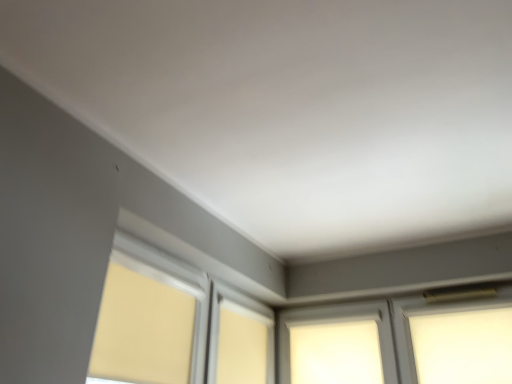
Question: Should I look upward or downward to see white frosted glass at upper right, placed as the second window when sorted from left to right?

Choices:
 (A) down
 (B) up

Answer: (A)

Question: Considering the relative sizes of white frosted glass at center, acting as the first window starting from the left, and white frosted glass at upper right, which appears as the 1th window when viewed from the right, in the image provided, is white frosted glass at center, acting as the first window starting from the left, smaller than white frosted glass at upper right, which appears as the 1th window when viewed from the right,?

Choices:
 (A) yes
 (B) no

Answer: (B)

Question: Is white frosted glass at center, acting as the first window starting from the left, with white frosted glass at upper right, which appears as the 1th window when viewed from the right?

Choices:
 (A) no
 (B) yes

Answer: (A)

Question: Is white frosted glass at center, the 2th window in the right-to-left sequence, taller than white frosted glass at upper right, which appears as the 1th window when viewed from the right?

Choices:
 (A) yes
 (B) no

Answer: (A)

Question: Considering the relative sizes of white frosted glass at center, the 2th window in the right-to-left sequence, and white frosted glass at upper right, which appears as the 1th window when viewed from the right, in the image provided, is white frosted glass at center, the 2th window in the right-to-left sequence, shorter than white frosted glass at upper right, which appears as the 1th window when viewed from the right,?

Choices:
 (A) yes
 (B) no

Answer: (B)

Question: Could you tell me if white frosted glass at center, the 2th window in the right-to-left sequence, is facing white frosted glass at upper right, placed as the second window when sorted from left to right?

Choices:
 (A) no
 (B) yes

Answer: (A)

Question: Can you confirm if white frosted glass at center, acting as the first window starting from the left, is bigger than white frosted glass at upper right, which appears as the 1th window when viewed from the right?

Choices:
 (A) no
 (B) yes

Answer: (B)

Question: Is white frosted glass at upper right, placed as the second window when sorted from left to right, surrounding matte yellow roller shade at lower left?

Choices:
 (A) no
 (B) yes

Answer: (A)

Question: Is white frosted glass at upper right, which appears as the 1th window when viewed from the right, wider than matte yellow roller shade at lower left?

Choices:
 (A) no
 (B) yes

Answer: (B)

Question: Is white frosted glass at upper right, placed as the second window when sorted from left to right, at the right side of matte yellow roller shade at lower left?

Choices:
 (A) yes
 (B) no

Answer: (A)

Question: Considering the relative sizes of white frosted glass at upper right, placed as the second window when sorted from left to right, and matte yellow roller shade at lower left in the image provided, is white frosted glass at upper right, placed as the second window when sorted from left to right, bigger than matte yellow roller shade at lower left?

Choices:
 (A) no
 (B) yes

Answer: (A)

Question: Is white frosted glass at upper right, which appears as the 1th window when viewed from the right, completely or partially outside of matte yellow roller shade at lower left?

Choices:
 (A) yes
 (B) no

Answer: (A)

Question: From the image's perspective, does white frosted glass at upper right, which appears as the 1th window when viewed from the right, appear lower than matte yellow roller shade at lower left?

Choices:
 (A) yes
 (B) no

Answer: (A)

Question: Considering the relative sizes of matte yellow roller shade at lower left and white frosted glass at upper right, placed as the second window when sorted from left to right, in the image provided, is matte yellow roller shade at lower left wider than white frosted glass at upper right, placed as the second window when sorted from left to right,?

Choices:
 (A) no
 (B) yes

Answer: (A)